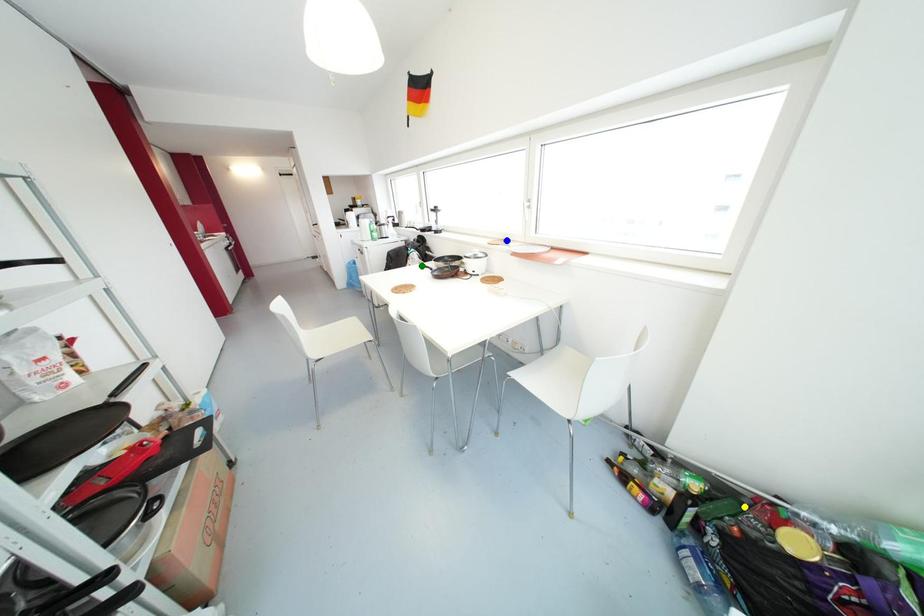
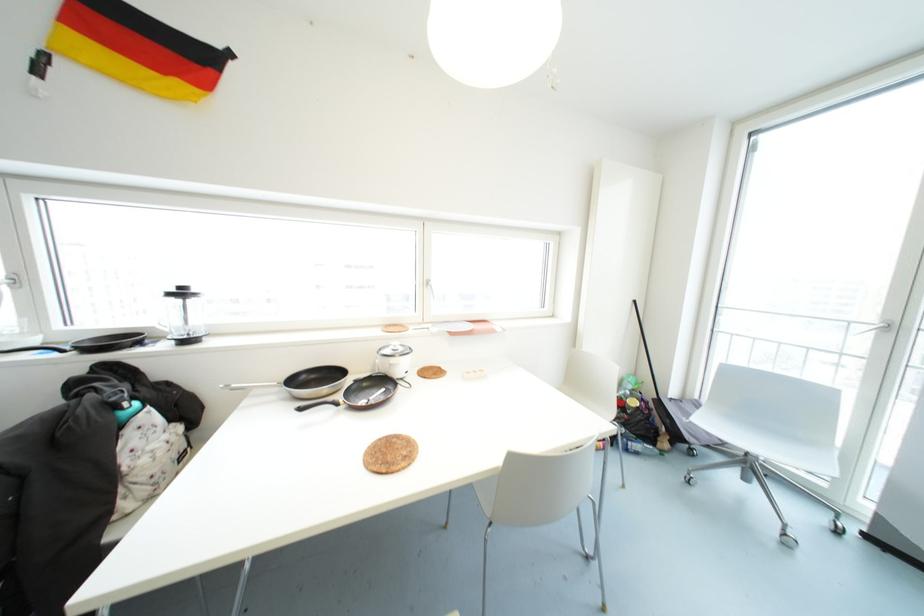
I am providing you with two images of the same scene from different viewpoints. Three points are marked in image1. Which point corresponds to a part or object that is occluded in image2?In image1, three points are marked. Which of them correspond to a part or object that is occluded in image2?Among the three points shown in image1, which one corresponds to a part or object that is no longer visible due to occlusion in image2?

yellow point